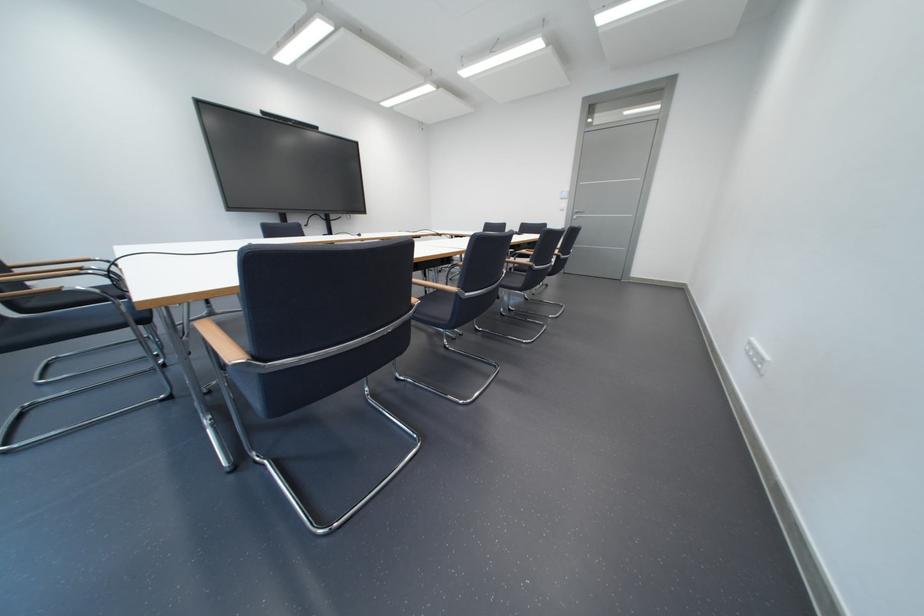
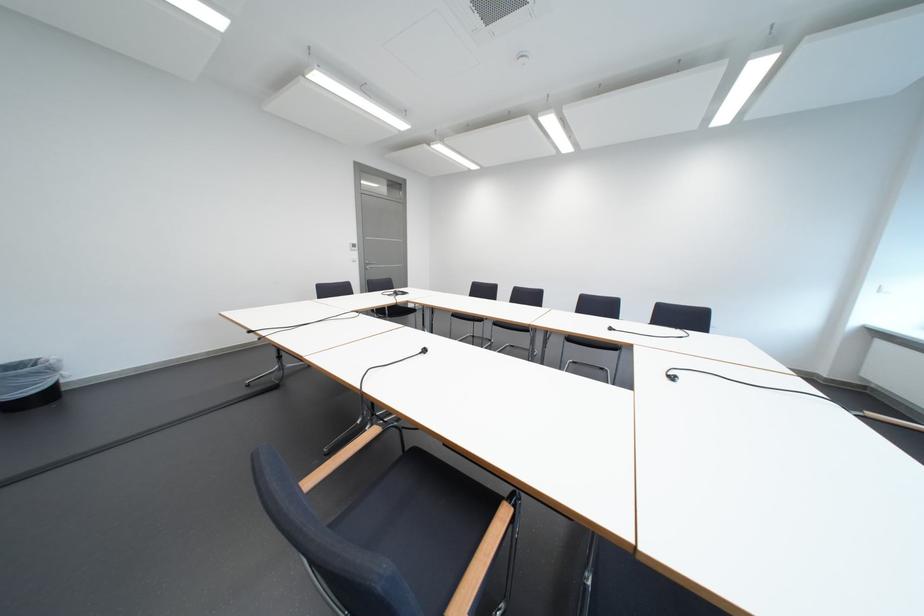
The point at (577, 215) is marked in the first image. Where is the corresponding point in the second image?

(369, 265)